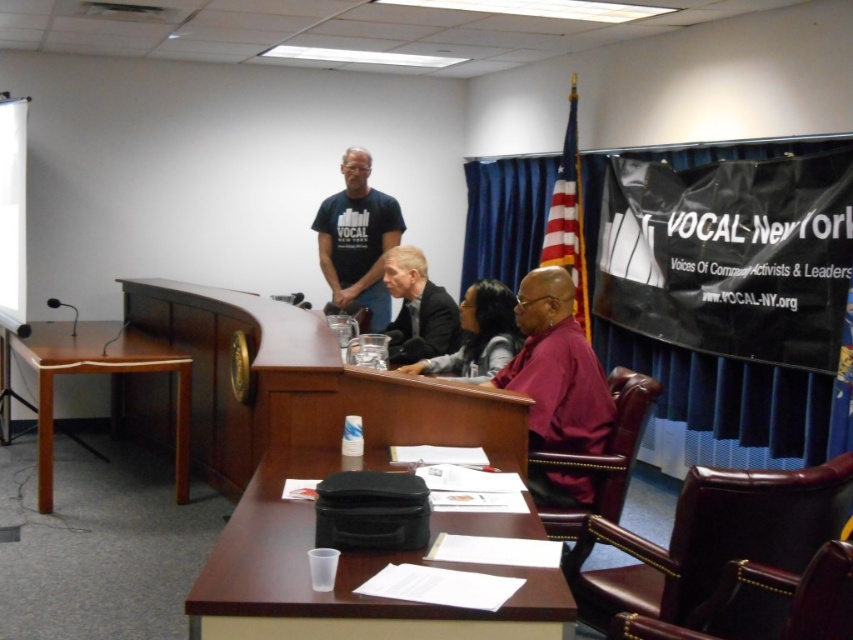
You are a photographer who needs to take a photo of the purple matte shirt at center from a distance of 8 feet. Can you position yourself at the current camera position to achieve this?

The purple matte shirt at center and camera are 8.68 feet apart, so positioning yourself at the current camera position would allow you to take the photo from approximately 8.7 feet away, which is slightly beyond the desired 8 feet distance.